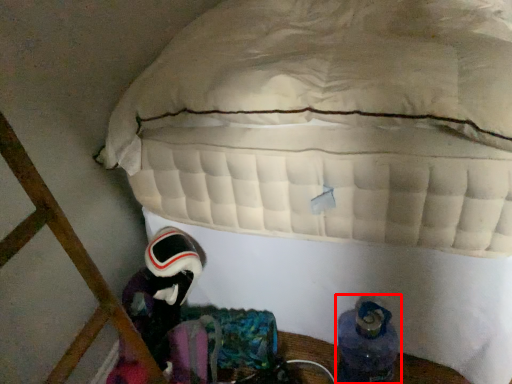
Question: In this image, where is footwear (annotated by the red box) located relative to astronaut?

Choices:
 (A) right
 (B) left

Answer: (A)